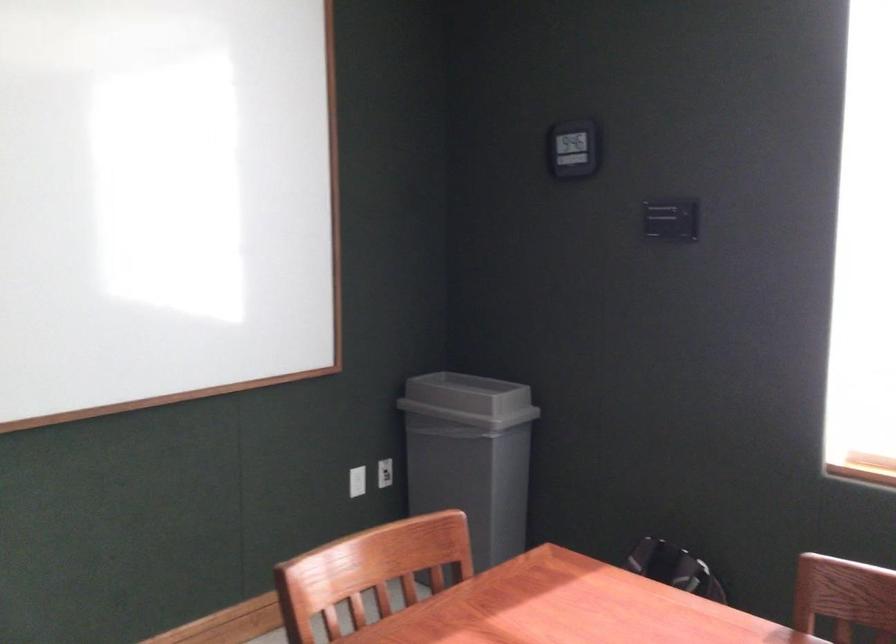
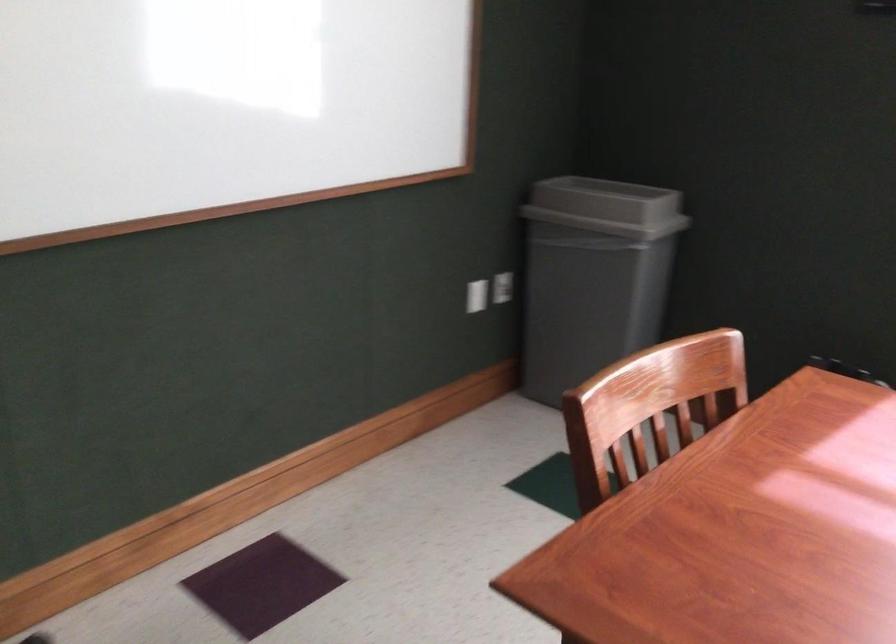
The images are taken continuously from a first-person perspective. In which direction are you moving?

The movement direction of the cameraman is left, forward.